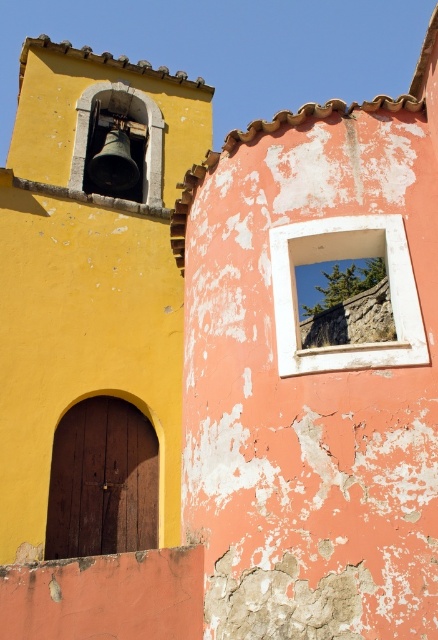
You are an architect evaluating the two buildings. You need to determine which object, the white wooden window at center or the metallic bell at upper left, requires more attention for maintenance based on their sizes. According to the scene description, which one is larger and thus might need more materials?

The metallic bell at upper left is larger than the white wooden window at center, so it might need more materials for maintenance.